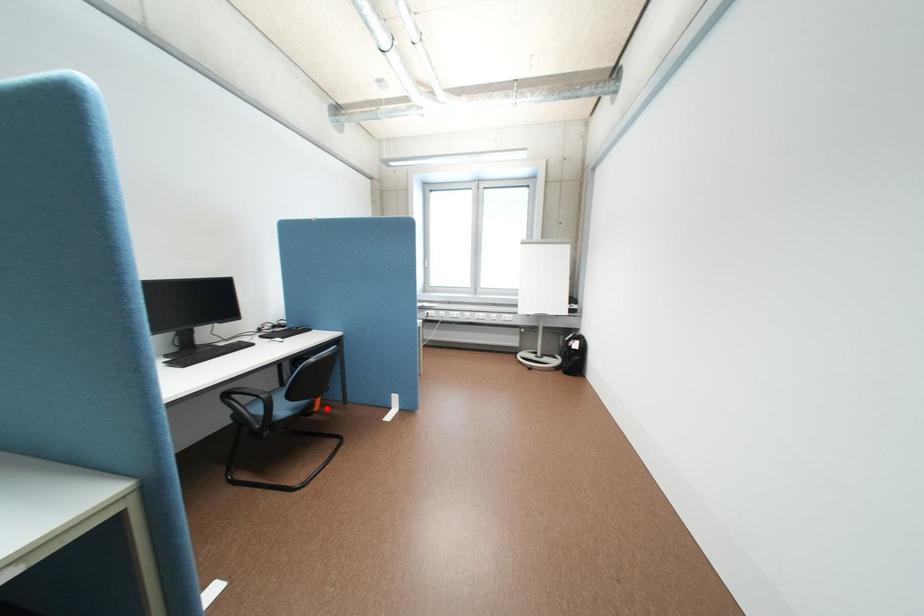
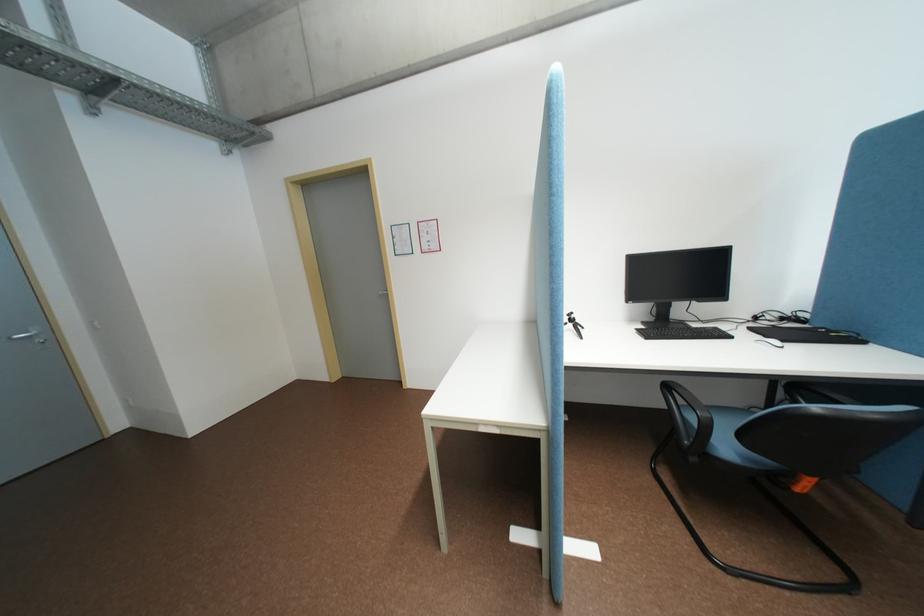
Question: I am providing you with two images of the same scene from different viewpoints. In image1, a red point is highlighted. Considering the same 3D point in image2, which of the following is correct?

Choices:
 (A) It is closer
 (B) It is farther

Answer: (A)